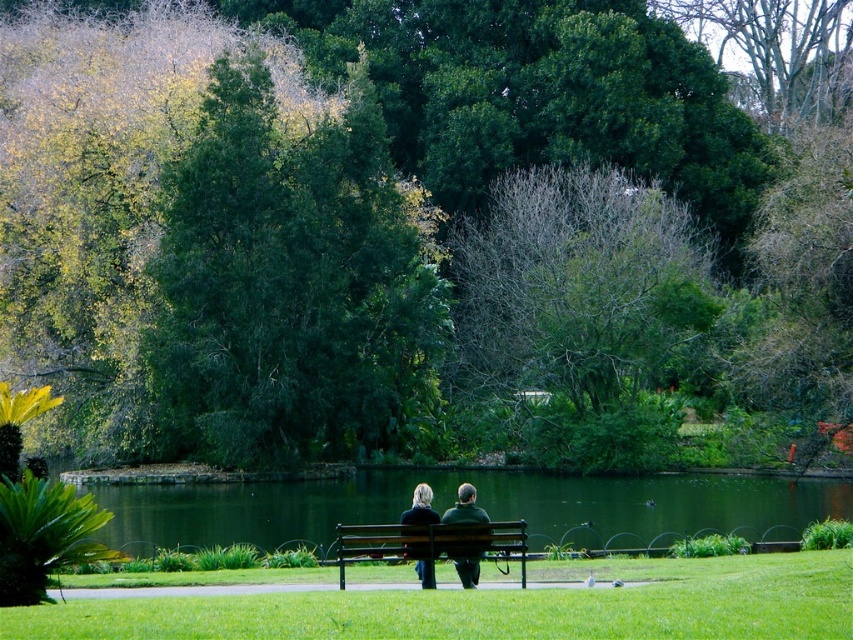
Does green leafy tree at center have a lesser height compared to blonde hair at center?

Incorrect, green leafy tree at center's height does not fall short of blonde hair at center's.

Can you confirm if green leafy tree at center is thinner than blonde hair at center?

No, green leafy tree at center is not thinner than blonde hair at center.

Is point (422, 417) positioned behind point (408, 515)?

Yes, it is.

Locate an element on the screen. The width and height of the screenshot is (853, 640). green leafy tree at center is located at coordinates (408, 232).

Who is higher up, green leafy tree at center or wooden bench at center?

green leafy tree at center

Does point (482, 17) lie in front of point (335, 531)?

No, (482, 17) is further to viewer.

Identify the location of green leafy tree at center. (408, 232).

The width and height of the screenshot is (853, 640). Find the location of `green leafy tree at center`. green leafy tree at center is located at coordinates (408, 232).

From the picture: Between green leafy tree at upper center and wooden bench at center, which one appears on the right side from the viewer's perspective?

From the viewer's perspective, wooden bench at center appears more on the right side.

Locate an element on the screen. This screenshot has width=853, height=640. green leafy tree at upper center is located at coordinates (289, 284).

Measure the distance between green leafy tree at upper center and camera.

green leafy tree at upper center and camera are 41.30 meters apart.

Identify the location of green leafy tree at upper center. (289, 284).